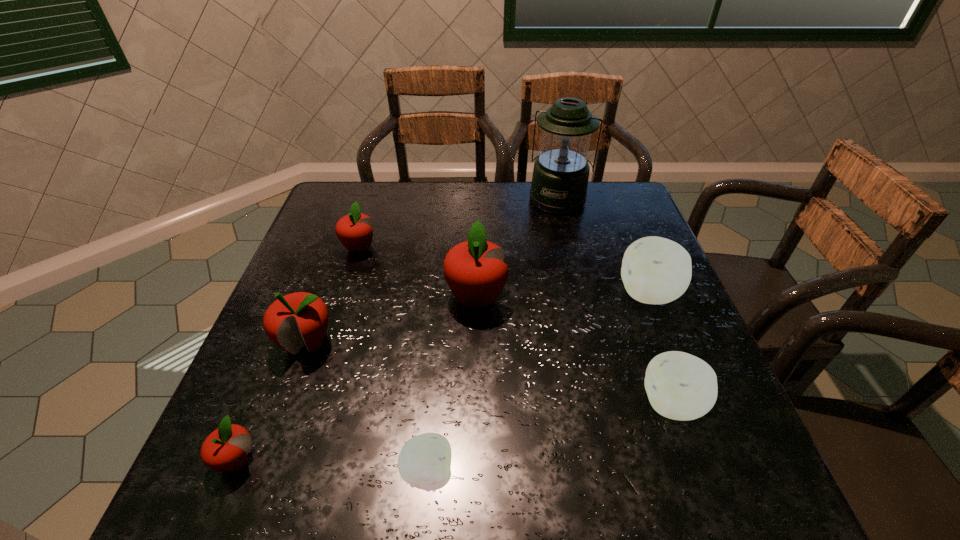
At what (x,y) coordinates should I click in order to perform the action: click on the third closest object to the second smallest white apple. Please return your answer as a coordinate pair (x, y). This screenshot has width=960, height=540. Looking at the image, I should click on (424, 462).

Identify the location of apple that is the third closest one to the second biggest white apple. (424, 462).

Find the location of a particular element. This screenshot has height=540, width=960. the sixth closest apple to the third biggest red apple is located at coordinates (680, 386).

Point out which red apple is positioned as the third nearest to the tallest apple. Please provide its 2D coordinates. Your answer should be formatted as a tuple, i.e. [(x, y)], where the tuple contains the x and y coordinates of a point satisfying the conditions above.

[(226, 448)]

In order to click on red apple identified as the second closest to the lantern in this screenshot , I will do `click(355, 231)`.

The height and width of the screenshot is (540, 960). In order to click on the second closest white apple to the biggest white apple in this screenshot , I will do `click(424, 462)`.

Where is `white apple that is the nearest to the smallest white apple`? The height and width of the screenshot is (540, 960). white apple that is the nearest to the smallest white apple is located at coordinates (680, 386).

Where is `vacant space that satisfies the following two spatial constraints: 1. on the back side of the third farthest red apple; 2. on the right side of the biggest red apple`? The image size is (960, 540). vacant space that satisfies the following two spatial constraints: 1. on the back side of the third farthest red apple; 2. on the right side of the biggest red apple is located at coordinates (324, 297).

Where is `vacant area that satisfies the following two spatial constraints: 1. on the front side of the lantern; 2. on the right side of the farthest white apple`? The width and height of the screenshot is (960, 540). vacant area that satisfies the following two spatial constraints: 1. on the front side of the lantern; 2. on the right side of the farthest white apple is located at coordinates (581, 294).

The height and width of the screenshot is (540, 960). What are the coordinates of `vacant space that satisfies the following two spatial constraints: 1. on the front side of the smallest red apple; 2. on the left side of the leftmost white apple` in the screenshot? It's located at (231, 473).